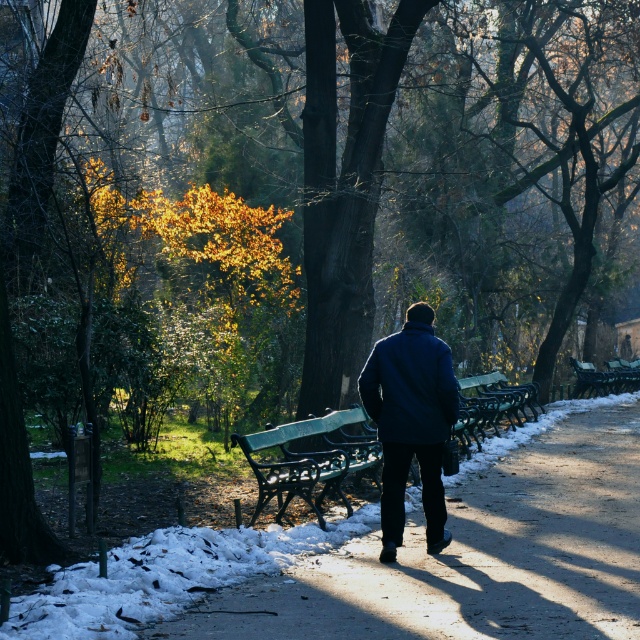
Describe the element at coordinates (410, 420) in the screenshot. This screenshot has width=640, height=640. I see `dark blue coat at center` at that location.

Which of these two, dark blue coat at center or green polished wood bench at center-right, stands taller?

dark blue coat at center

Does point (412, 412) come behind point (532, 387)?

No, (412, 412) is closer to viewer.

The image size is (640, 640). I want to click on dark blue coat at center, so click(410, 420).

Does navy blue fleece jacket at center have a lesser height compared to green painted metal bench at center?

Incorrect, navy blue fleece jacket at center's height does not fall short of green painted metal bench at center's.

Is navy blue fleece jacket at center positioned before green painted metal bench at center?

Yes.

What do you see at coordinates (410, 387) in the screenshot? I see `navy blue fleece jacket at center` at bounding box center [410, 387].

Find the location of a particular element. Image resolution: width=640 pixels, height=640 pixels. navy blue fleece jacket at center is located at coordinates (410, 387).

Does point (525, 612) come closer to viewer compared to point (339, 444)?

Yes, point (525, 612) is in front of point (339, 444).

Based on the photo, which of these two, green wooden bench at center or green painted metal bench at center, stands taller?

Standing taller between the two is green painted metal bench at center.

Which is in front, point (436, 628) or point (333, 448)?

Point (436, 628)

At what (x,y) coordinates should I click in order to perform the action: click on green wooden bench at center. Please return your answer as a coordinate pair (x, y). This screenshot has height=640, width=640. Looking at the image, I should click on (474, 554).